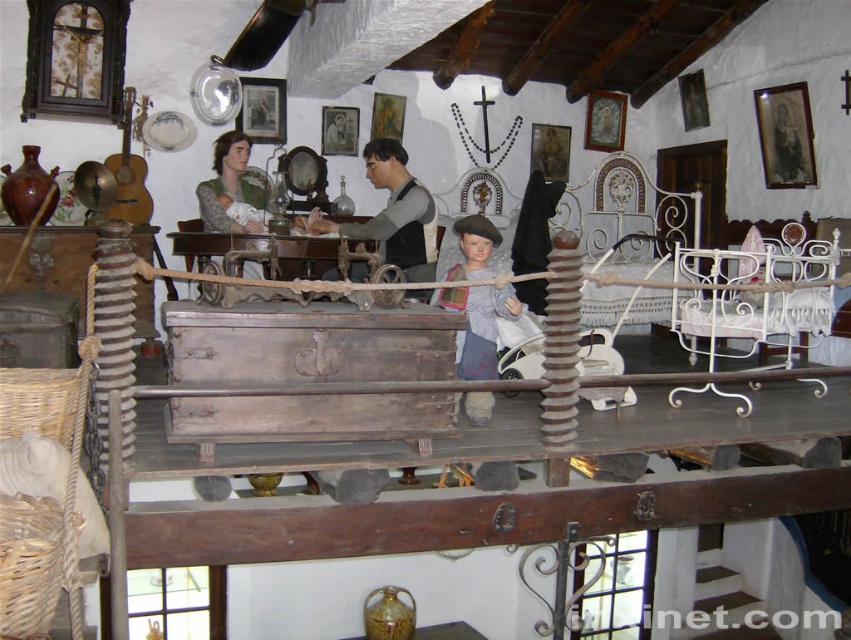
You are a visitor in this historical room and want to place a small souvenir between the wooden doll at center and the wooden table at center. Can you fit it there if the souvenir requires at least 30 inches of space?

The wooden doll at center and wooden table at center are 34.26 inches apart, so yes, the souvenir can be placed there since the space is sufficient.

You are a delivery person who needs to place a package between the wooden chest at center and the smooth gray shirt at center. The package is 1.5 meters long. Will there be enough space between them to fit the package?

The wooden chest at center and smooth gray shirt at center are 1.53 meters apart from each other. Since the package is 1.5 meters long, there will be enough space to fit it between them as the distance is slightly more than the package length.